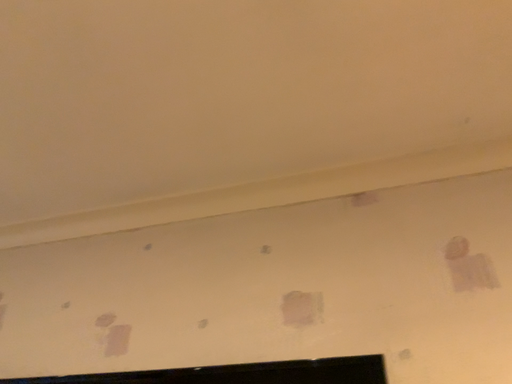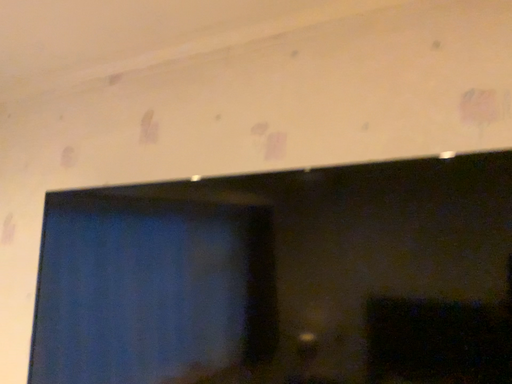
Question: How did the camera likely rotate when shooting the video?

Choices:
 (A) rotated downward
 (B) rotated upward

Answer: (A)